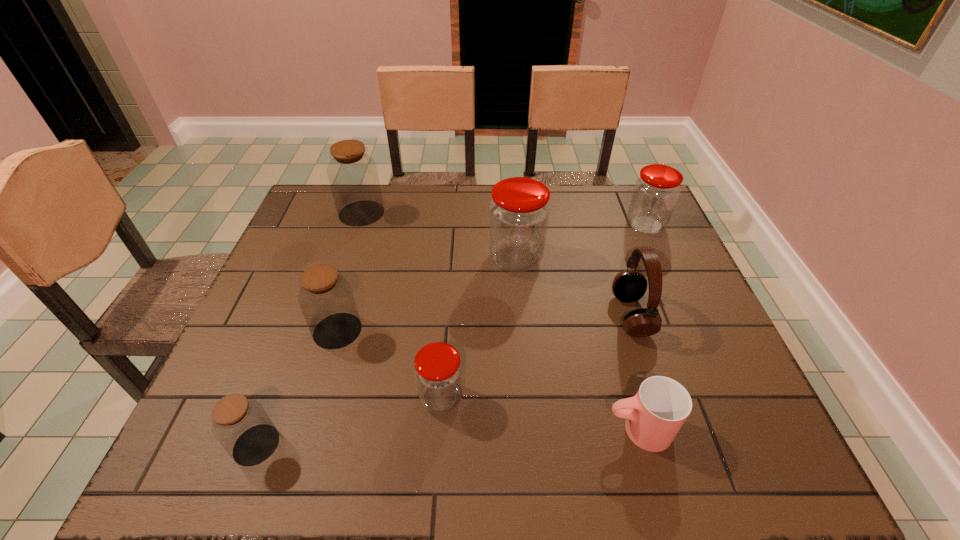
In order to click on red jar that stands as the second closest to the smallest red jar in this screenshot , I will do coord(656,192).

The image size is (960, 540). Identify the location of red jar identified as the closest to the farthest red jar. click(519, 212).

Find the location of a particular element. This screenshot has width=960, height=540. vacant space that satisfies the following two spatial constraints: 1. on the ear pads of the black headset; 2. on the front side of the third nearest jar is located at coordinates (636, 330).

The image size is (960, 540). I want to click on free space that satisfies the following two spatial constraints: 1. on the front side of the farthest brown jar; 2. on the right side of the leftmost red jar, so click(301, 397).

Identify the location of vacant position in the image that satisfies the following two spatial constraints: 1. on the side of the shortest object with the handle; 2. on the front side of the smallest red jar. Image resolution: width=960 pixels, height=540 pixels. (629, 397).